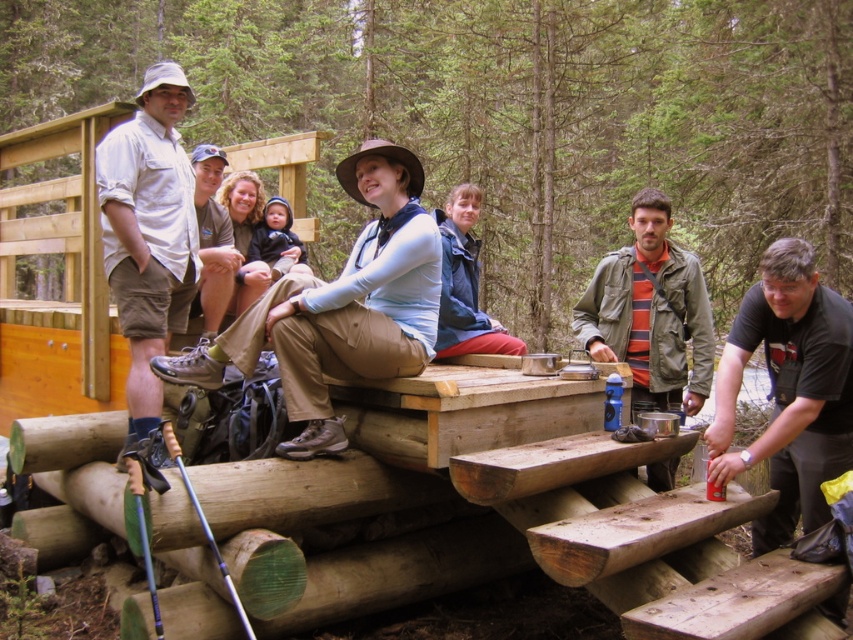
Is point (384, 234) behind point (804, 388)?

Yes, it is behind point (804, 388).

Can you confirm if khaki cotton pants at center is smaller than black matte shirt at lower right?

No.

Who is more distant from viewer, [326,390] or [775,378]?

The point [775,378] is behind.

Where is `khaki cotton pants at center`? The width and height of the screenshot is (853, 640). khaki cotton pants at center is located at coordinates (341, 307).

Does green wood bench at center appear over striped cotton shirt at center?

Yes, green wood bench at center is above striped cotton shirt at center.

Which is more to the left, green wood bench at center or striped cotton shirt at center?

Positioned to the left is green wood bench at center.

The width and height of the screenshot is (853, 640). I want to click on green wood bench at center, so click(x=509, y=113).

Is point (843, 593) less distant than point (134, 282)?

That is True.

Does black matte shirt at lower right have a greater height compared to white cotton shirt at left?

In fact, black matte shirt at lower right may be shorter than white cotton shirt at left.

This screenshot has height=640, width=853. What are the coordinates of `black matte shirt at lower right` in the screenshot? It's located at (788, 390).